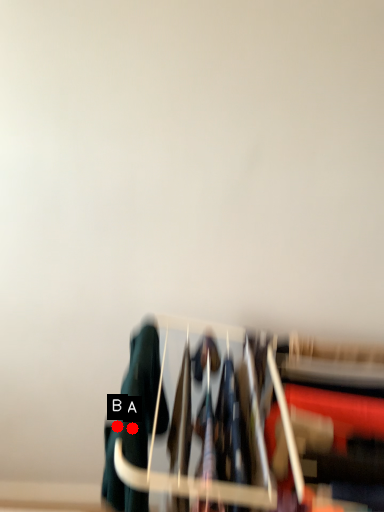
Question: Two points are circled on the image, labeled by A and B beside each circle. Which of the following is the farthest from the observer?

Choices:
 (A) A is further
 (B) B is further

Answer: (A)